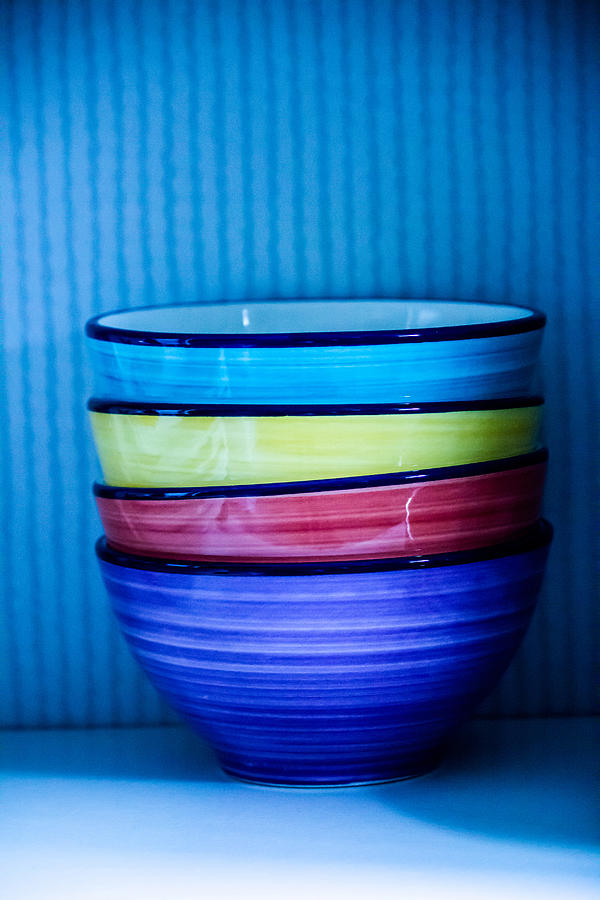
The image size is (600, 900). Identify the location of yellow bowl. (310, 445).